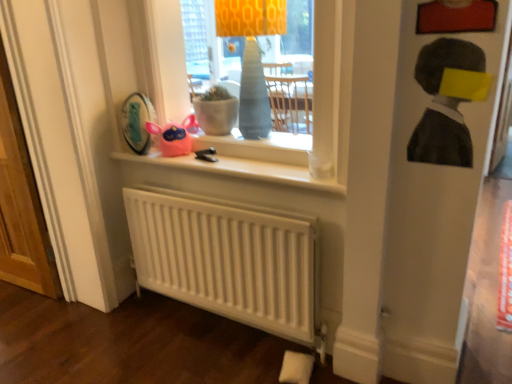
Where is `free point below white matte radiator at lower center (from a real-world perspective)`? The width and height of the screenshot is (512, 384). free point below white matte radiator at lower center (from a real-world perspective) is located at coordinates (223, 322).